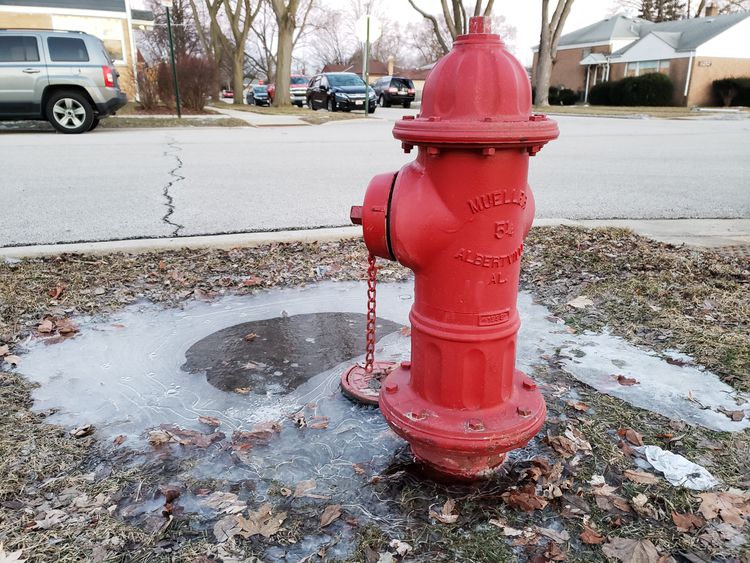
You are a GUI agent. You are given a task and a screenshot of the screen. Output one action in this format:
    pyautogui.click(x=<x>, y=<y>)
    Task: Click on the screws
    The width and height of the screenshot is (750, 563).
    Given the screenshot: What is the action you would take?
    pyautogui.click(x=396, y=365), pyautogui.click(x=391, y=388), pyautogui.click(x=412, y=406), pyautogui.click(x=466, y=420), pyautogui.click(x=523, y=415), pyautogui.click(x=526, y=384)